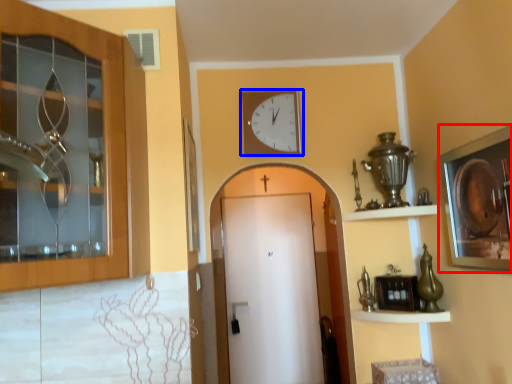
Question: Which object is further to the camera taking this photo, picture frame (highlighted by a red box) or wall clock (highlighted by a blue box)?

Choices:
 (A) picture frame
 (B) wall clock

Answer: (B)